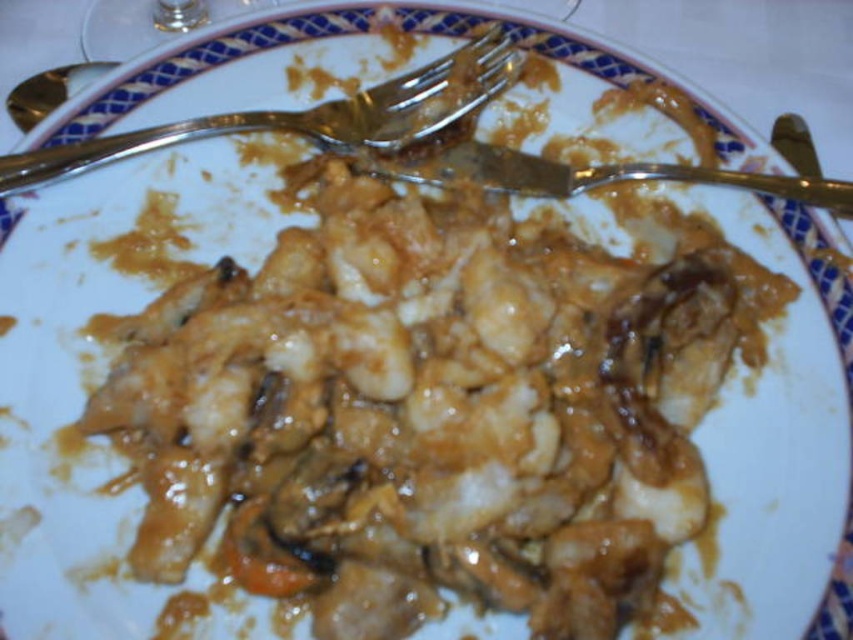
You are looking at the plate and want to pick up the utensil closest to you. Which point, point (x=270, y=113) or point (x=401, y=172), is closer to you?

Point (x=270, y=113) is closer to the viewer than point (x=401, y=172), so you should pick up the utensil at point (x=270, y=113).

You are a chef holding a 1.2 meter long wooden spoon. You need to reach the satin silver knife at center on the plate. Can you reach it without moving your position?

The satin silver knife at center is 1.14 meters away from the viewer. Since the wooden spoon is 1.2 meters long, the chef can extend the spoon to reach the satin silver knife at center as the distance is slightly shorter than the spoon length.